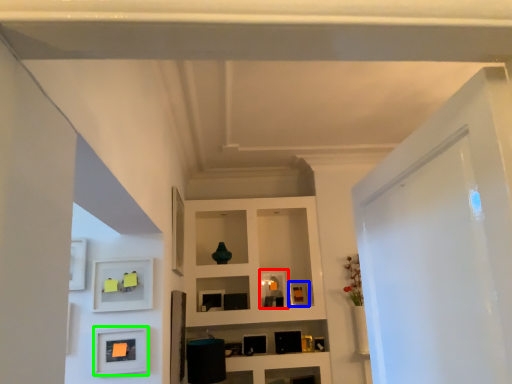
Question: Which is nearer to the picture frame (highlighted by a red box)? picture frame (highlighted by a blue box) or picture frame (highlighted by a green box).

Choices:
 (A) picture frame
 (B) picture frame

Answer: (A)